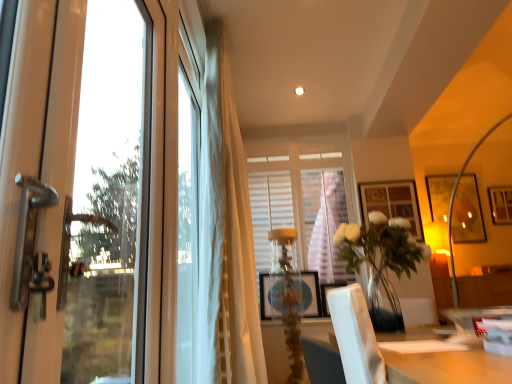
Where is `free point above white sheer curtain at center (from a real-world perspective)`? The height and width of the screenshot is (384, 512). free point above white sheer curtain at center (from a real-world perspective) is located at coordinates (239, 31).